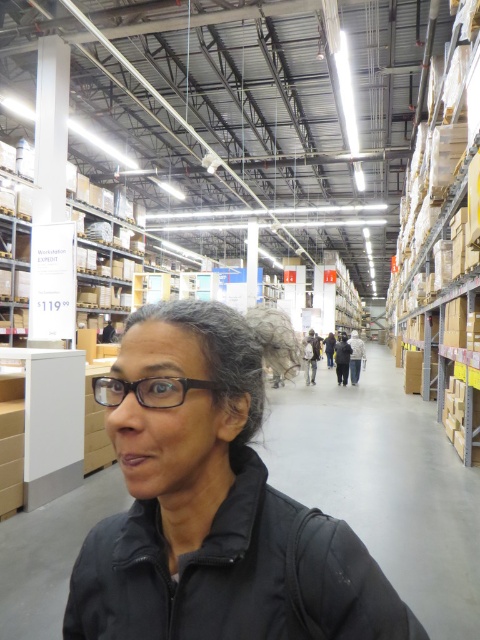
Question: Which of the following is the farthest from the observer?

Choices:
 (A) (214, 328)
 (B) (477, 273)

Answer: (B)

Question: Which object appears closest to the camera in this image?

Choices:
 (A) brown cardboard boxes at right
 (B) gray matte hair at center
 (C) dark gray jacket at center

Answer: (B)

Question: Based on their relative distances, which object is farther from the brown cardboard boxes at right?

Choices:
 (A) gray matte hair at center
 (B) dark gray jacket at center

Answer: (A)

Question: Can you confirm if black matte jacket at lower left is positioned to the left of dark gray jacket at center?

Choices:
 (A) no
 (B) yes

Answer: (B)

Question: Considering the relative positions of black matte jacket at lower left and dark gray jacket at center in the image provided, where is black matte jacket at lower left located with respect to dark gray jacket at center?

Choices:
 (A) right
 (B) left

Answer: (B)

Question: Is black matte jacket at lower left further to the viewer compared to gray matte hair at center?

Choices:
 (A) yes
 (B) no

Answer: (B)